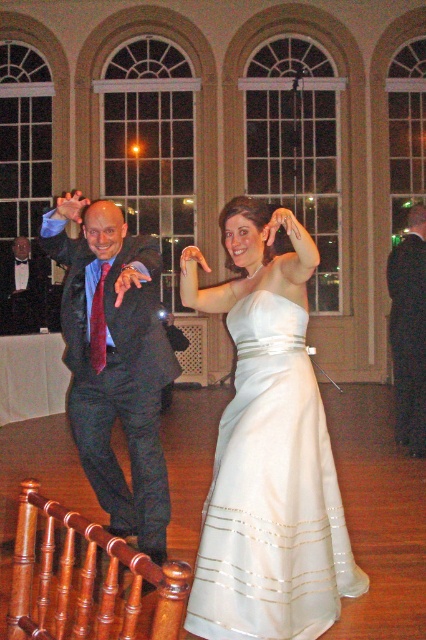
Which is behind, point (241, 588) or point (149, 536)?

Positioned behind is point (149, 536).

Which is in front, point (264, 536) or point (77, 356)?

Point (264, 536)

Does point (233, 616) come farther from viewer compared to point (135, 531)?

No.

This screenshot has width=426, height=640. I want to click on matte white dress at center, so click(267, 451).

Which is more to the left, matte white dress at center or dark gray suit at right?

Positioned to the left is matte white dress at center.

Who is taller, matte white dress at center or dark gray suit at right?

dark gray suit at right is taller.

Does point (342, 522) come closer to viewer compared to point (416, 209)?

That is True.

Where is `matte white dress at center`? matte white dress at center is located at coordinates (267, 451).

Can you confirm if white satin dress at center is shorter than matte black suit at center?

Indeed, white satin dress at center has a lesser height compared to matte black suit at center.

How much distance is there between white satin dress at center and matte black suit at center?

white satin dress at center and matte black suit at center are 27.41 inches apart from each other.

This screenshot has height=640, width=426. What are the coordinates of `white satin dress at center` in the screenshot? It's located at (271, 493).

The height and width of the screenshot is (640, 426). I want to click on white satin dress at center, so click(271, 493).